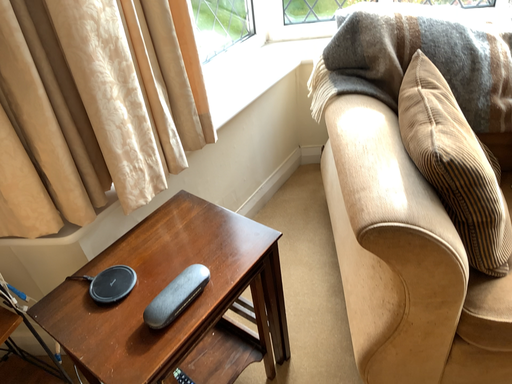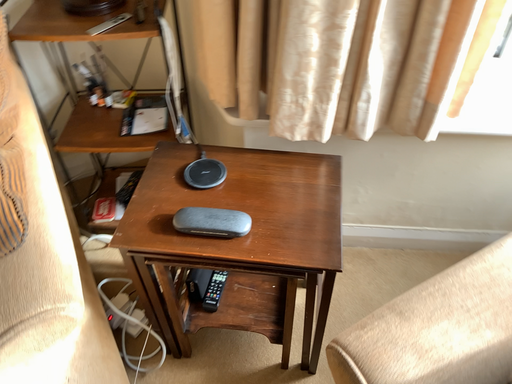
Question: Which way did the camera rotate in the video?

Choices:
 (A) rotated left
 (B) rotated right

Answer: (A)